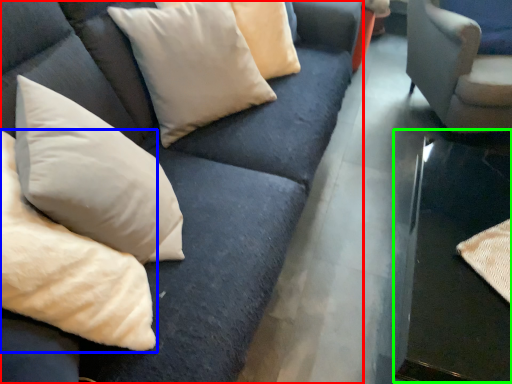
Question: Which is farther away from studio couch (highlighted by a red box)? pillow (highlighted by a blue box) or table (highlighted by a green box)?

Choices:
 (A) pillow
 (B) table

Answer: (B)